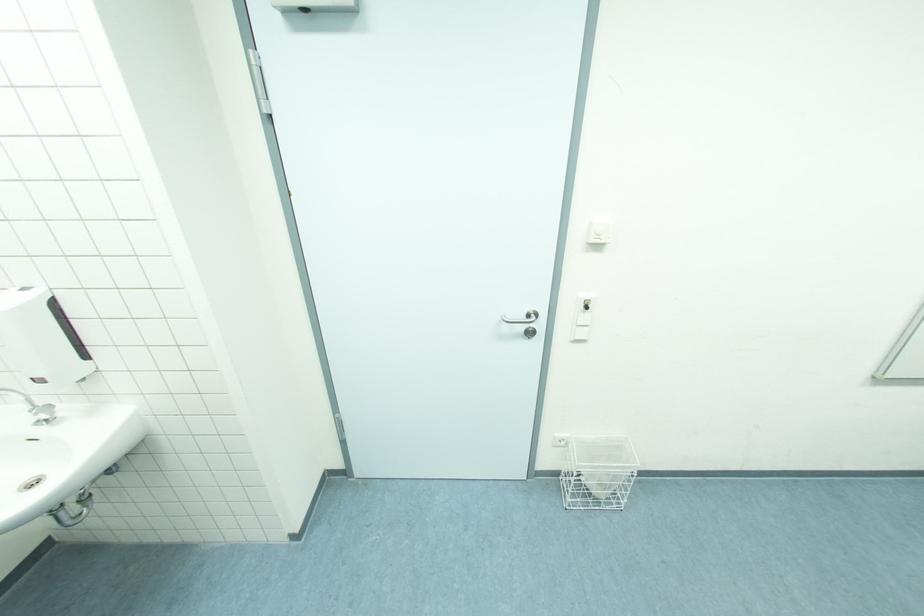
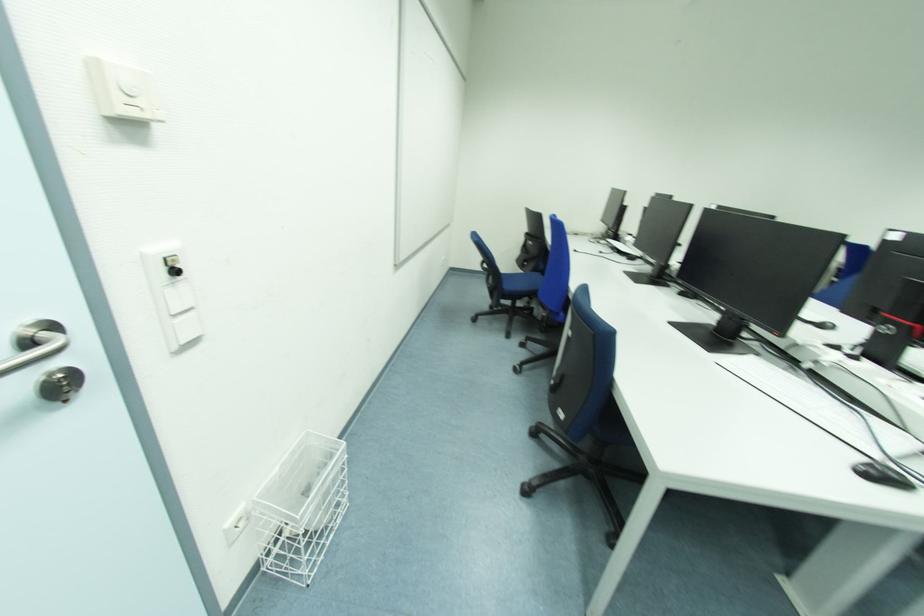
The point at (532, 329) is marked in the first image. Where is the corresponding point in the second image?

(55, 375)